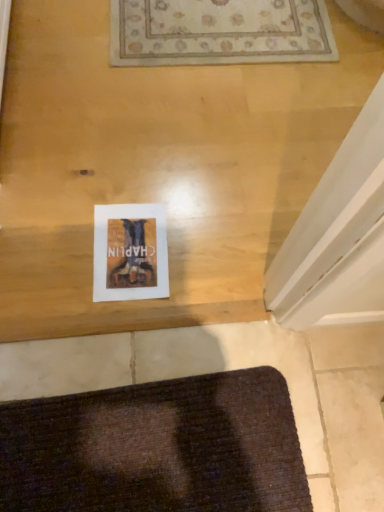
The height and width of the screenshot is (512, 384). Describe the element at coordinates (157, 448) in the screenshot. I see `dark brown textured mat at lower left` at that location.

You are a GUI agent. You are given a task and a screenshot of the screen. Output one action in this format:
    pyautogui.click(x=<x>, y=<y>)
    Task: Click on the dark brown textured mat at lower left
    The width and height of the screenshot is (384, 512).
    Given the screenshot: What is the action you would take?
    pyautogui.click(x=157, y=448)

Locate an element on the screen. dark brown textured mat at lower left is located at coordinates (157, 448).